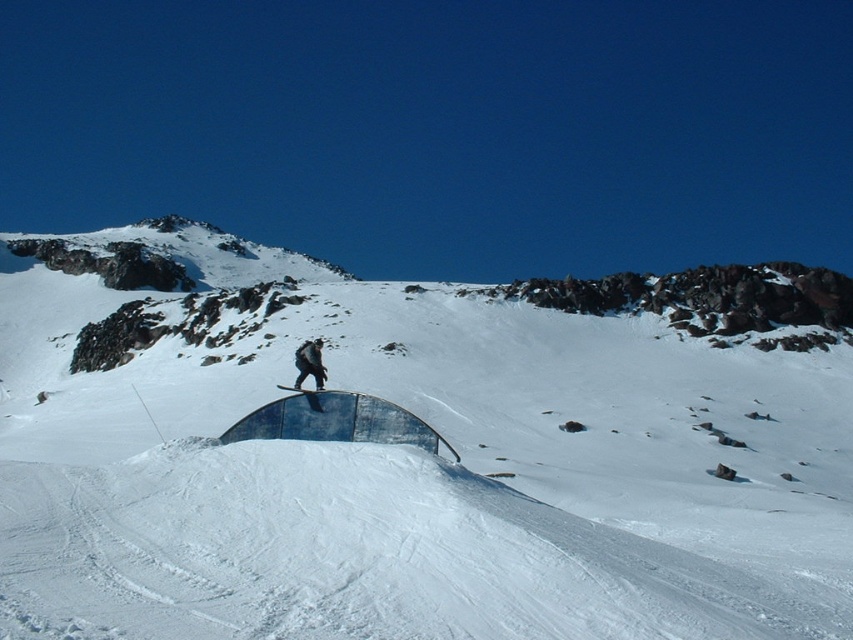
Is white matte snow at center taller than black matte snowboarder at center?

Yes, white matte snow at center is taller than black matte snowboarder at center.

Which is above, white matte snow at center or black matte snowboarder at center?

white matte snow at center is above.

Where is `white matte snow at center`? This screenshot has height=640, width=853. white matte snow at center is located at coordinates (408, 452).

Is white matte snow at center thinner than black matte snowboard at center?

In fact, white matte snow at center might be wider than black matte snowboard at center.

Looking at this image, is white matte snow at center shorter than black matte snowboard at center?

Incorrect, white matte snow at center's height does not fall short of black matte snowboard at center's.

What do you see at coordinates (408, 452) in the screenshot? The width and height of the screenshot is (853, 640). I see `white matte snow at center` at bounding box center [408, 452].

Identify the location of white matte snow at center. (408, 452).

Can you confirm if blue wooden snowboard at center is smaller than black matte snowboard at center?

Yes, blue wooden snowboard at center is smaller than black matte snowboard at center.

What are the coordinates of `blue wooden snowboard at center` in the screenshot? It's located at (306, 396).